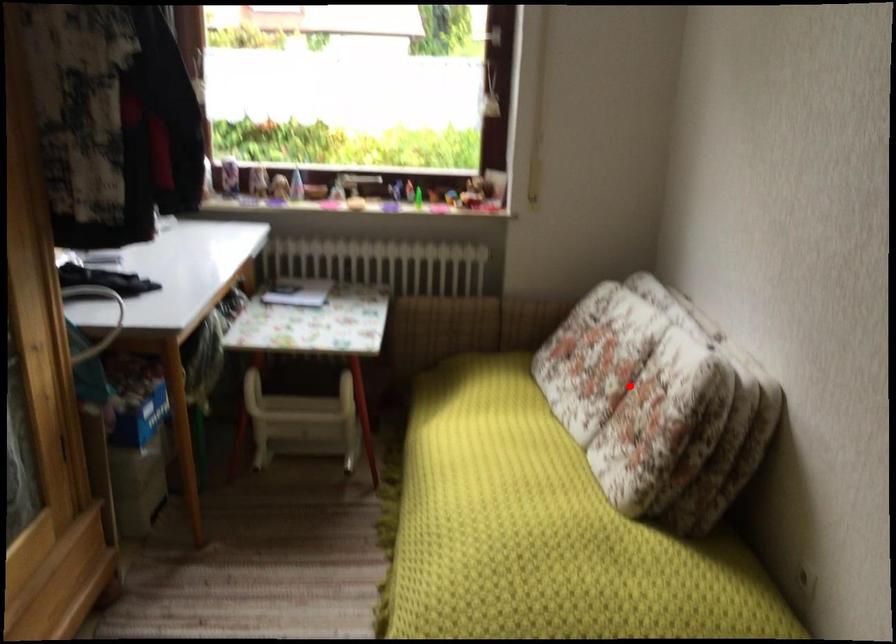
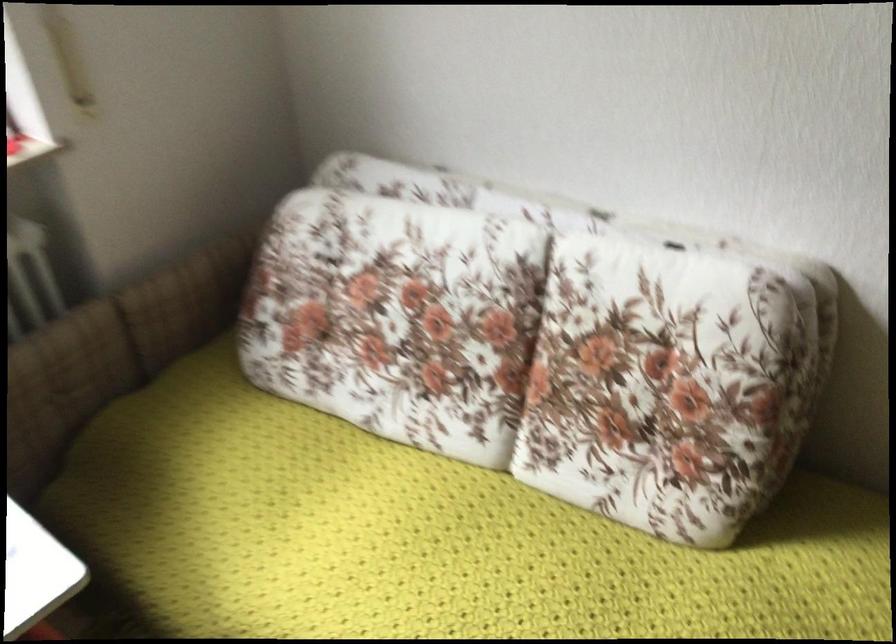
In the second image, find the point that corresponds to the highlighted location in the first image.

(530, 354)